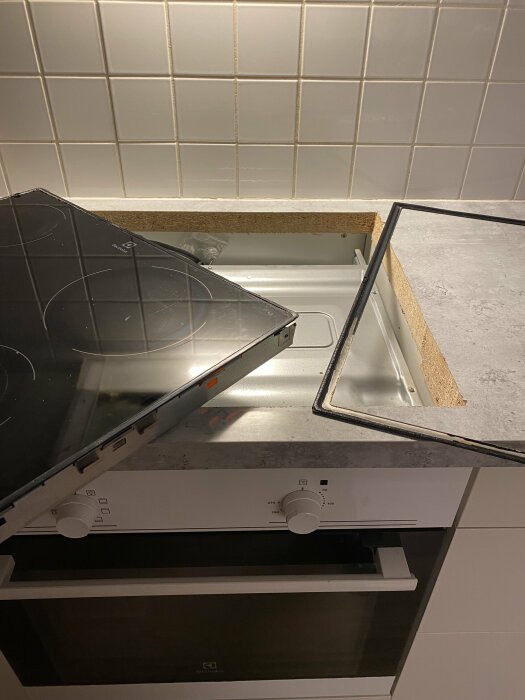
This screenshot has height=700, width=525. Identify the location of white knob on left. (82, 528).